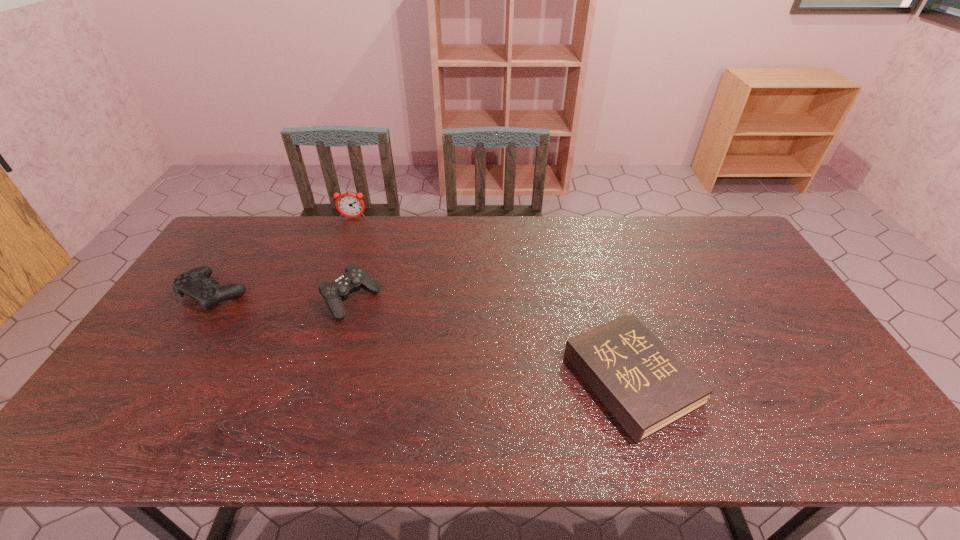
Where is `object situated at the far edge`? This screenshot has width=960, height=540. object situated at the far edge is located at coordinates (350, 205).

I want to click on object at the near edge, so click(646, 387).

At what (x,y) coordinates should I click in order to perform the action: click on object located in the left edge section of the desktop. Please return your answer as a coordinate pair (x, y). Looking at the image, I should click on (x=195, y=283).

The width and height of the screenshot is (960, 540). I want to click on free region at the far edge of the desktop, so click(x=281, y=240).

Where is `free space at the left edge of the desktop`? free space at the left edge of the desktop is located at coordinates (233, 259).

At what (x,y) coordinates should I click in order to perform the action: click on free space at the right edge of the desktop. Please return your answer as a coordinate pair (x, y). Image resolution: width=960 pixels, height=540 pixels. Looking at the image, I should click on (780, 330).

The image size is (960, 540). What are the coordinates of `free space at the far left corner` in the screenshot? It's located at (255, 218).

Image resolution: width=960 pixels, height=540 pixels. In order to click on empty space between the farthest object and the nearest object in this screenshot , I will do `click(492, 299)`.

This screenshot has width=960, height=540. What are the coordinates of `unoccupied position between the shortest object and the left control` in the screenshot? It's located at (423, 336).

Image resolution: width=960 pixels, height=540 pixels. In order to click on free space between the farthest object and the left control in this screenshot , I will do `click(284, 255)`.